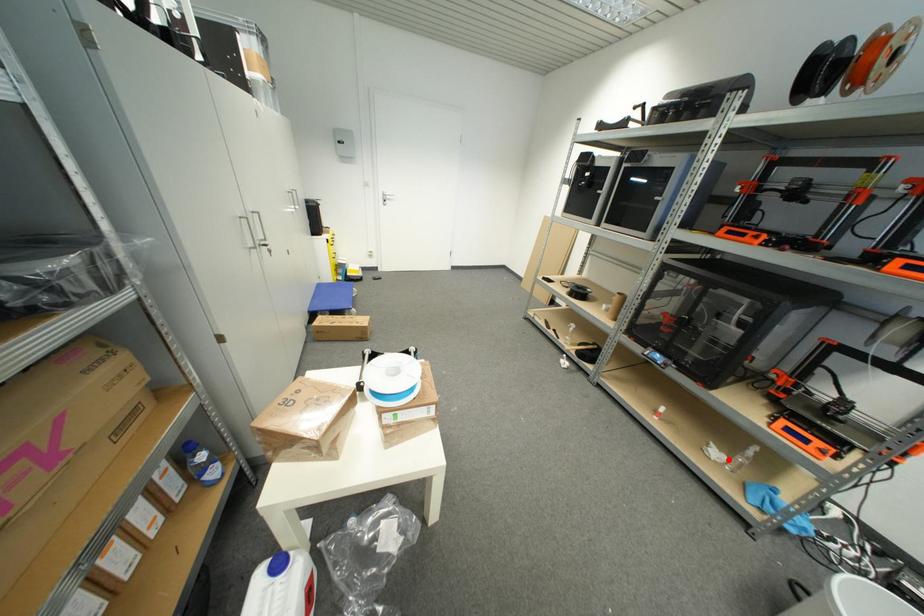
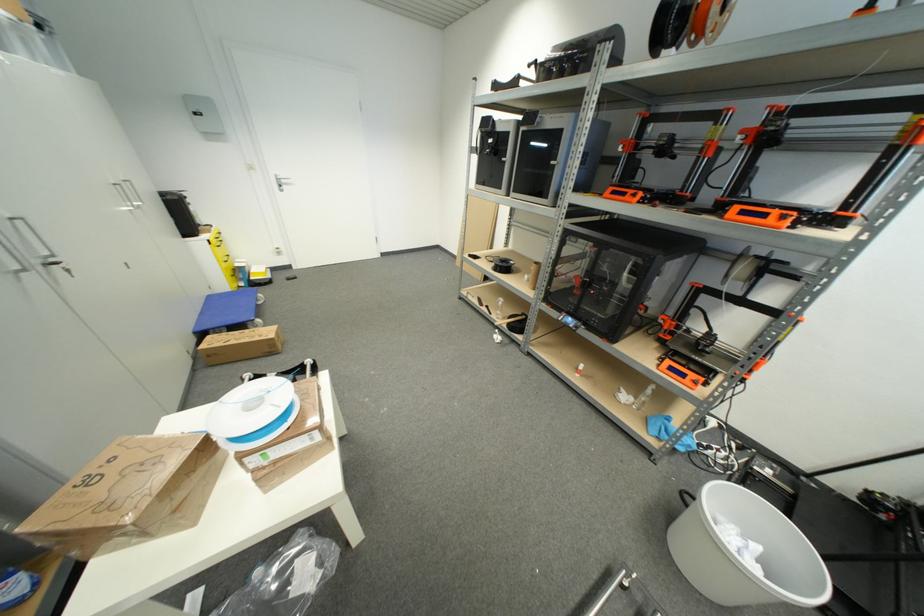
The point at the highlighted location is marked in the first image. Where is the corresponding point in the second image?

(636, 400)